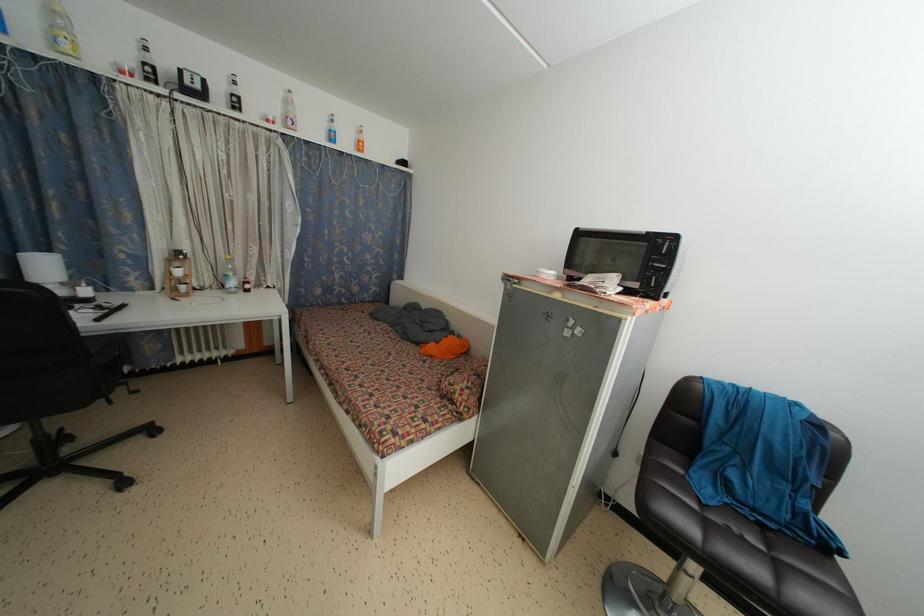
Identify the location of black chair armrest. (108, 357).